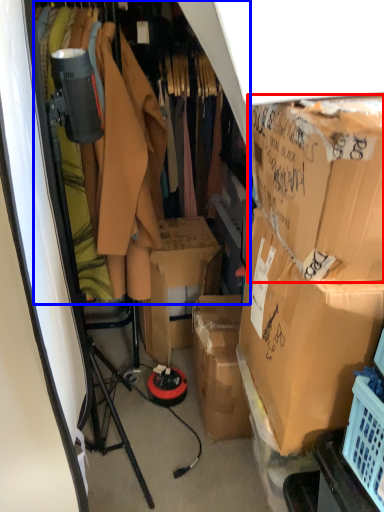
Question: Which object appears farthest to the camera in this image, box (highlighted by a red box) or closet (highlighted by a blue box)?

Choices:
 (A) box
 (B) closet

Answer: (B)